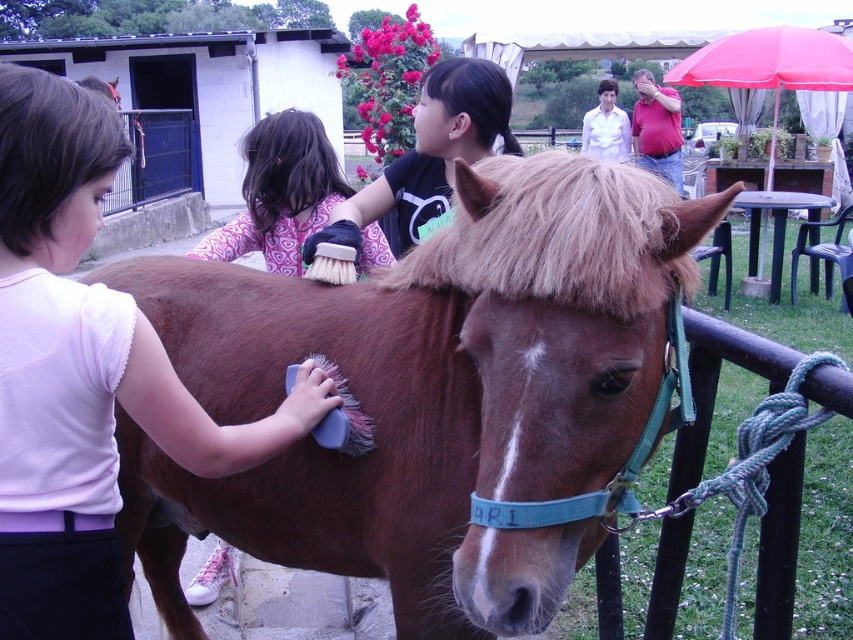
Does fuzzy brown mane at center appear over patterned fabric brush at upper center?

Actually, fuzzy brown mane at center is below patterned fabric brush at upper center.

Which is more to the left, fuzzy brown mane at center or patterned fabric brush at upper center?

patterned fabric brush at upper center

Where is `fuzzy brown mane at center`? This screenshot has width=853, height=640. fuzzy brown mane at center is located at coordinates (561, 234).

Can you confirm if brown matte horse at center is wider than black fabric shirt at upper center?

Yes, brown matte horse at center is wider than black fabric shirt at upper center.

Who is lower down, brown matte horse at center or black fabric shirt at upper center?

brown matte horse at center

Between point (706, 195) and point (448, 104), which one is positioned behind?

The point (706, 195) is behind.

The height and width of the screenshot is (640, 853). Find the location of `brown matte horse at center`. brown matte horse at center is located at coordinates (428, 394).

Which of these two, matte white shirt at left or black fabric shirt at upper center, stands shorter?

black fabric shirt at upper center is shorter.

In the scene shown: Who is higher up, matte white shirt at left or black fabric shirt at upper center?

black fabric shirt at upper center is higher up.

You are a GUI agent. You are given a task and a screenshot of the screen. Output one action in this format:
    pyautogui.click(x=<x>, y=<y>)
    Task: Click on the matte white shirt at left
    The width and height of the screenshot is (853, 640).
    Given the screenshot: What is the action you would take?
    pyautogui.click(x=83, y=372)

Image resolution: width=853 pixels, height=640 pixels. Identify the location of matte white shirt at left. (83, 372).